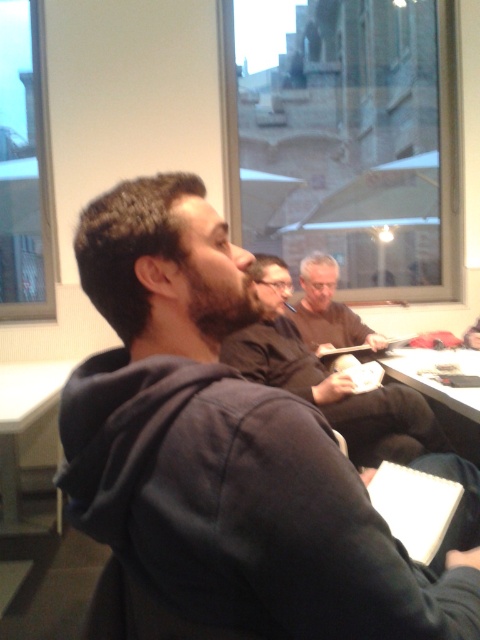
Does gray hair man at center have a lesser height compared to white paper at center?

In fact, gray hair man at center may be taller than white paper at center.

Between gray hair man at center and white paper at center, which one is positioned higher?

gray hair man at center is higher up.

In the scene shown: Who is more distant from viewer, [372,332] or [431,396]?

The point [372,332] is more distant.

The width and height of the screenshot is (480, 640). Find the location of `gray hair man at center`. gray hair man at center is located at coordinates (327, 308).

Does white plastic table at lower left come behind white paper at center?

That is True.

Which is more to the left, white plastic table at lower left or white paper at center?

white plastic table at lower left

Who is more forward, (0, 488) or (384, 369)?

Point (384, 369) is in front.

This screenshot has height=640, width=480. What are the coordinates of `white plastic table at lower left` in the screenshot? It's located at (25, 433).

Which of these two, black hoodie at center or dark brown leather jacket at center, stands shorter?

With less height is black hoodie at center.

Can you confirm if black hoodie at center is wider than dark brown leather jacket at center?

In fact, black hoodie at center might be narrower than dark brown leather jacket at center.

Identify the location of black hoodie at center. The height and width of the screenshot is (640, 480). click(x=219, y=456).